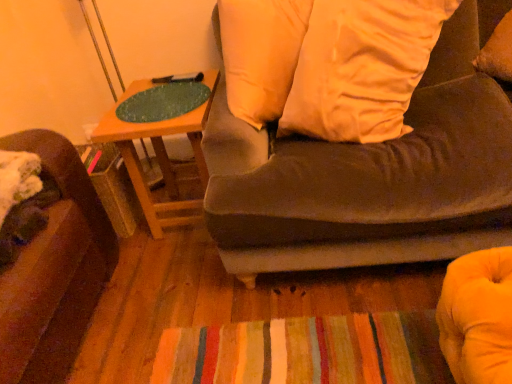
Question: Is wooden table at upper center aimed at suede-like brown couch at upper right?

Choices:
 (A) yes
 (B) no

Answer: (B)

Question: Is wooden table at upper center taller than suede-like brown couch at upper right?

Choices:
 (A) no
 (B) yes

Answer: (A)

Question: Does wooden table at upper center have a lesser width compared to suede-like brown couch at upper right?

Choices:
 (A) no
 (B) yes

Answer: (B)

Question: Would you consider wooden table at upper center to be distant from suede-like brown couch at upper right?

Choices:
 (A) yes
 (B) no

Answer: (B)

Question: Can suede-like brown couch at upper right be found inside wooden table at upper center?

Choices:
 (A) no
 (B) yes

Answer: (A)

Question: Is green felt at upper left bigger or smaller than suede-like brown couch at upper right?

Choices:
 (A) big
 (B) small

Answer: (B)

Question: From the image's perspective, is green felt at upper left above or below suede-like brown couch at upper right?

Choices:
 (A) below
 (B) above

Answer: (B)

Question: Is point (153, 92) closer or farther from the camera than point (371, 172)?

Choices:
 (A) farther
 (B) closer

Answer: (A)

Question: Looking at their shapes, would you say green felt at upper left is wider or thinner than suede-like brown couch at upper right?

Choices:
 (A) thin
 (B) wide

Answer: (A)

Question: In the image, is wooden table at upper center on the left side or the right side of green felt at upper left?

Choices:
 (A) left
 (B) right

Answer: (B)

Question: Is wooden table at upper center situated inside green felt at upper left or outside?

Choices:
 (A) inside
 (B) outside

Answer: (B)

Question: From the image's perspective, relative to green felt at upper left, is wooden table at upper center above or below?

Choices:
 (A) below
 (B) above

Answer: (A)

Question: Does point (147, 79) appear closer or farther from the camera than point (187, 82)?

Choices:
 (A) farther
 (B) closer

Answer: (A)

Question: Is white soft pillow at upper center inside or outside of wooden table at upper center?

Choices:
 (A) outside
 (B) inside

Answer: (A)

Question: From a real-world perspective, relative to wooden table at upper center, is white soft pillow at upper center vertically above or below?

Choices:
 (A) above
 (B) below

Answer: (A)